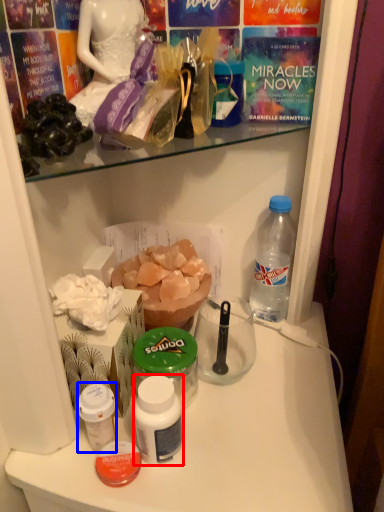
Question: Which point is closer to the camera, bottle (highlighted by a red box) or bottle (highlighted by a blue box)?

Choices:
 (A) bottle
 (B) bottle

Answer: (A)